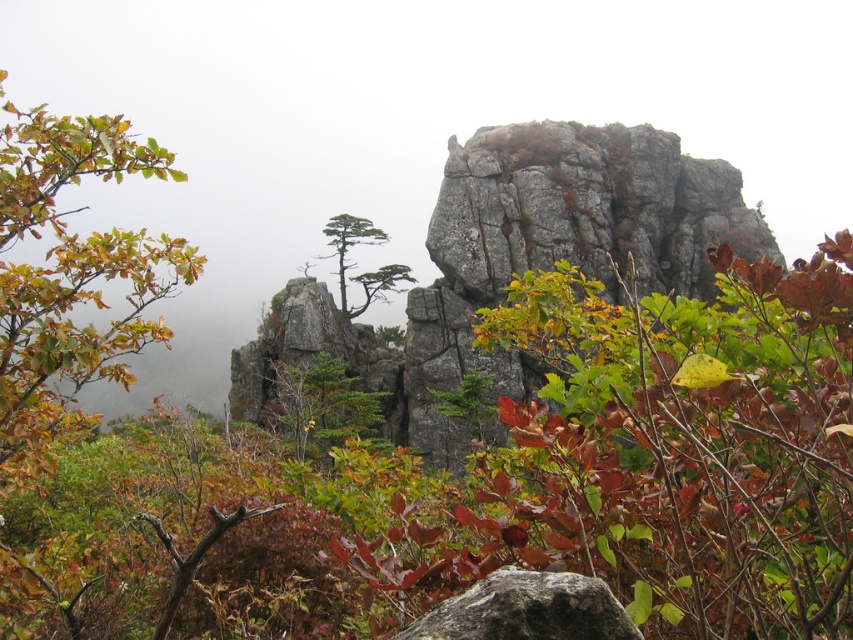
Question: Among these objects, which one is farthest from the camera?

Choices:
 (A) green matte tree at center
 (B) green leafy shrub at center

Answer: (A)

Question: Is gray rough boulder at center below green matte tree at center?

Choices:
 (A) no
 (B) yes

Answer: (B)

Question: Does gray rough boulder at center have a greater width compared to green matte tree at center?

Choices:
 (A) yes
 (B) no

Answer: (B)

Question: Among these objects, which one is farthest from the camera?

Choices:
 (A) gray rough boulder at center
 (B) green matte tree at center
 (C) green leafy shrub at center

Answer: (B)

Question: Which point appears farthest from the camera in this image?

Choices:
 (A) (595, 602)
 (B) (346, 305)

Answer: (B)

Question: Can you confirm if gray rough boulder at center is bigger than green matte tree at center?

Choices:
 (A) no
 (B) yes

Answer: (A)